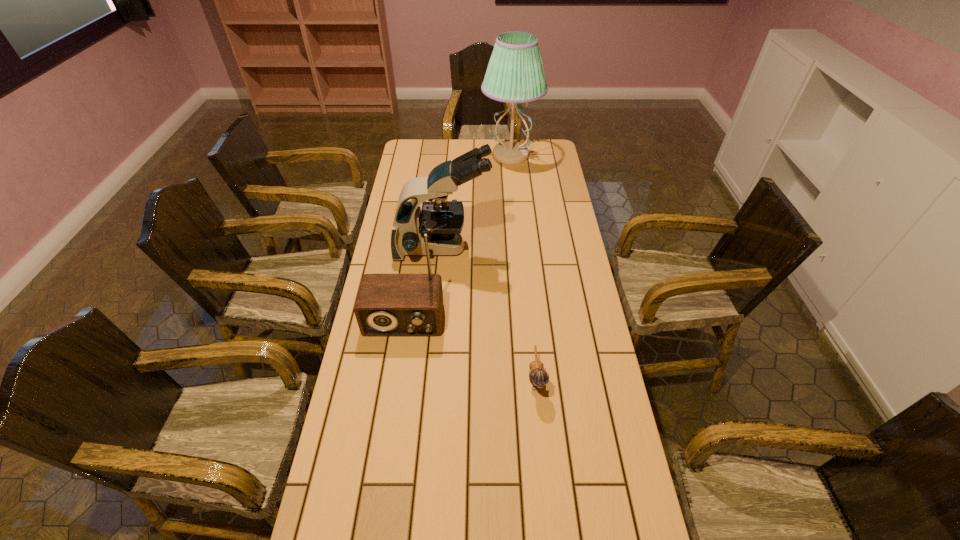
Locate an element on the screen. the tallest object is located at coordinates (515, 74).

Where is `the farthest object`? The height and width of the screenshot is (540, 960). the farthest object is located at coordinates (515, 74).

Where is `microscope`? This screenshot has height=540, width=960. microscope is located at coordinates (442, 220).

Where is `the third nearest object`? the third nearest object is located at coordinates (442, 220).

What are the coordinates of `the third farthest object` in the screenshot? It's located at point(387,304).

At what (x,y) coordinates should I click in order to perform the action: click on radio receiver. Please return your answer as a coordinate pair (x, y). Looking at the image, I should click on (387, 304).

Locate an element on the screen. The image size is (960, 540). kitten is located at coordinates (538, 376).

You are a GUI agent. You are given a task and a screenshot of the screen. Output one action in this format:
    pyautogui.click(x=<x>, y=<y>)
    Task: Click on the shortest object
    The width and height of the screenshot is (960, 540).
    Given the screenshot: What is the action you would take?
    pyautogui.click(x=538, y=376)

Where is `blank space located 0.230m on the front of the tallest object`? The width and height of the screenshot is (960, 540). blank space located 0.230m on the front of the tallest object is located at coordinates (515, 201).

This screenshot has height=540, width=960. Find the location of `vacant position located 0.120m through the eyepieces of the second tallest object`. vacant position located 0.120m through the eyepieces of the second tallest object is located at coordinates (521, 248).